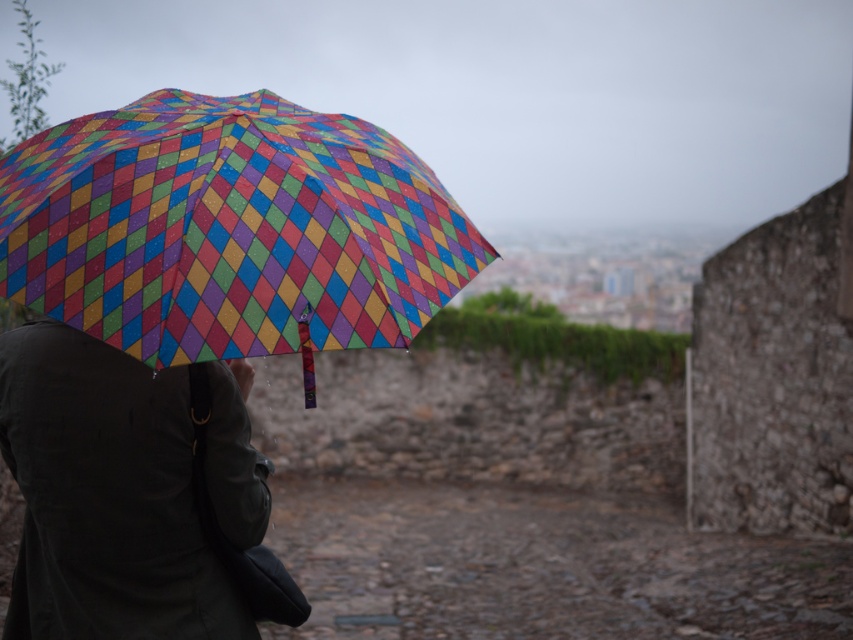
Between multicolored diamond-patterned umbrella at left and matte black coat at center, which one appears on the left side from the viewer's perspective?

matte black coat at center

Identify the location of multicolored diamond-patterned umbrella at left. The width and height of the screenshot is (853, 640). (229, 228).

You are a GUI agent. You are given a task and a screenshot of the screen. Output one action in this format:
    pyautogui.click(x=<x>, y=<y>)
    Task: Click on the multicolored diamond-patterned umbrella at left
    
    Given the screenshot: What is the action you would take?
    pyautogui.click(x=229, y=228)